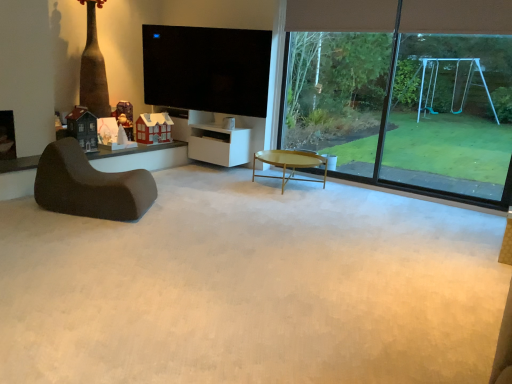
Where is `free space that is in between gold metallic coffee table at center and dark brown fabric chair at left`? The width and height of the screenshot is (512, 384). free space that is in between gold metallic coffee table at center and dark brown fabric chair at left is located at coordinates (212, 193).